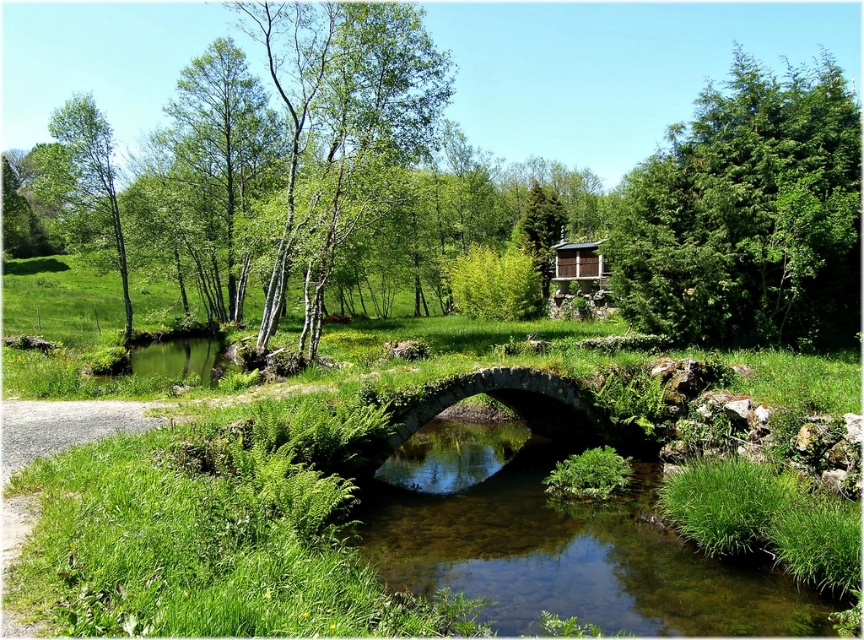
In the scene shown: You are planning to take a photo of the wooden cabin at upper center and the green leafy tree at left. Which object will occupy more space in the photo if you frame them both?

The green leafy tree at left will occupy more space in the photo because its width is larger than that of the wooden cabin at upper center.